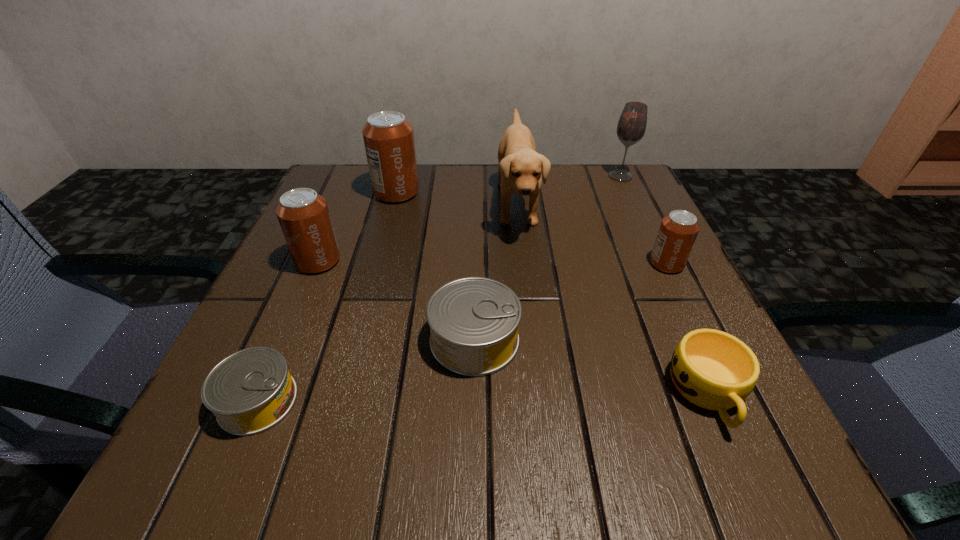
Find the location of a particular element. This screenshot has width=960, height=540. cup present at the right edge is located at coordinates click(x=712, y=369).

The height and width of the screenshot is (540, 960). Identify the location of object present at the far left corner. (388, 137).

Where is `object that is at the near left corner`? This screenshot has height=540, width=960. object that is at the near left corner is located at coordinates (250, 391).

What are the coordinates of `object located in the far right corner section of the desktop` in the screenshot? It's located at (631, 127).

Find the location of a particular element. The width and height of the screenshot is (960, 540). object located in the near right corner section of the desktop is located at coordinates tap(712, 369).

At what (x,y) coordinates should I click in order to perform the action: click on blank space at the far edge of the desktop. Please return your answer as a coordinate pair (x, y). Looking at the image, I should click on (516, 199).

Identify the location of free space at the near edge. This screenshot has width=960, height=540. (599, 447).

This screenshot has height=540, width=960. Find the location of `vacant space at the right edge of the desktop`. vacant space at the right edge of the desktop is located at coordinates (612, 244).

You are a GUI agent. You are given a task and a screenshot of the screen. Output one action in this format:
    pyautogui.click(x=<x>, y=<y>)
    Task: Click on the vacant region at the far left corner of the desktop
    The height and width of the screenshot is (540, 960).
    Given the screenshot: What is the action you would take?
    pyautogui.click(x=379, y=208)

This screenshot has height=540, width=960. In the image, there is a desktop. What are the coordinates of `vacant space at the far right corner` in the screenshot? It's located at (626, 183).